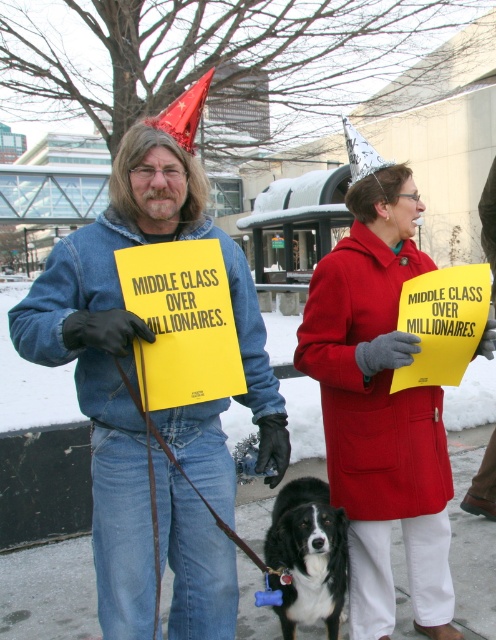
Question: Among these points, which one is nearest to the camera?

Choices:
 (A) (287, 554)
 (B) (214, 410)
 (C) (387, 394)

Answer: (B)

Question: Which point is farther to the camera?

Choices:
 (A) black fur dog at center
 (B) denim jacket at center

Answer: (A)

Question: Where is denim jacket at center located in relation to matte red coat at center in the image?

Choices:
 (A) above
 (B) below

Answer: (A)

Question: Does matte red coat at center appear on the left side of black fur dog at center?

Choices:
 (A) no
 (B) yes

Answer: (A)

Question: Which of the following is the farthest from the observer?

Choices:
 (A) (291, 620)
 (B) (223, 250)

Answer: (A)

Question: Where is denim jacket at center located in relation to black fur dog at center in the image?

Choices:
 (A) above
 (B) below

Answer: (A)